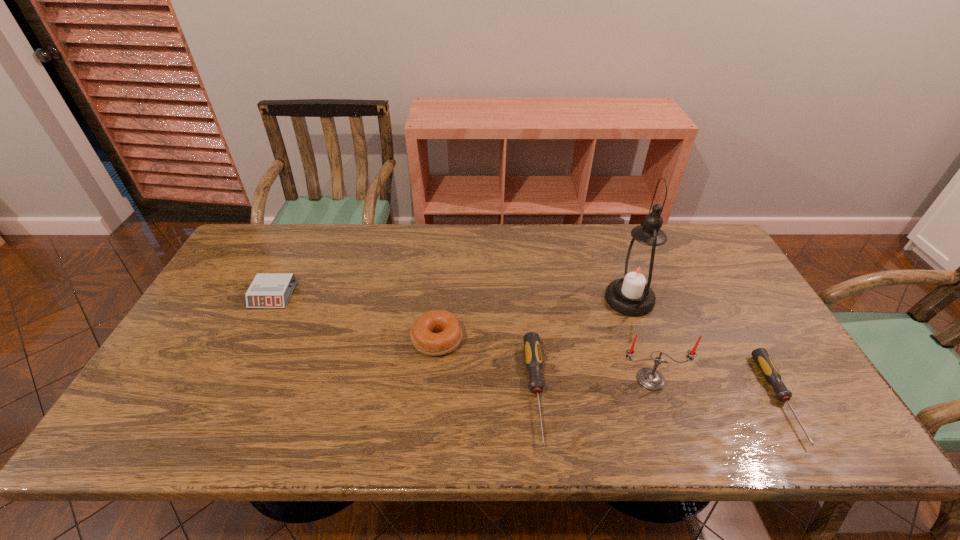
At what (x,y) coordinates should I click in order to perform the action: click on vacant space located on the right of the leftmost object. Please return your answer as a coordinate pair (x, y). Looking at the image, I should click on (406, 295).

Image resolution: width=960 pixels, height=540 pixels. In order to click on vacant space located on the right of the bagel in this screenshot , I will do point(538,340).

The height and width of the screenshot is (540, 960). I want to click on candle situated at the near edge, so click(x=650, y=378).

Find the location of `object at the left edge`. object at the left edge is located at coordinates (268, 290).

Identify the location of object at the right edge. The width and height of the screenshot is (960, 540). (770, 372).

Identify the location of object that is at the near right corner. The image size is (960, 540). (770, 372).

Image resolution: width=960 pixels, height=540 pixels. In the image, there is a desktop. In order to click on vacant space at the far edge in this screenshot , I will do `click(336, 233)`.

The image size is (960, 540). I want to click on blank space at the left edge of the desktop, so click(x=227, y=319).

Image resolution: width=960 pixels, height=540 pixels. What are the coordinates of `vacant space at the far left corner of the desktop` in the screenshot? It's located at (252, 256).

Locate an element on the screen. Image resolution: width=960 pixels, height=540 pixels. vacant space that's between the alarm clock and the fifth object from right to left is located at coordinates (355, 318).